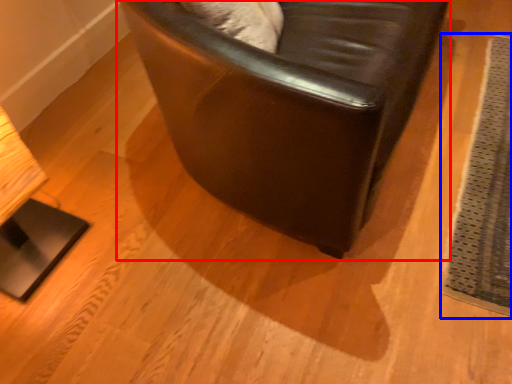
Question: Which point is further to the camera, chair (highlighted by a red box) or mat (highlighted by a blue box)?

Choices:
 (A) chair
 (B) mat

Answer: (B)